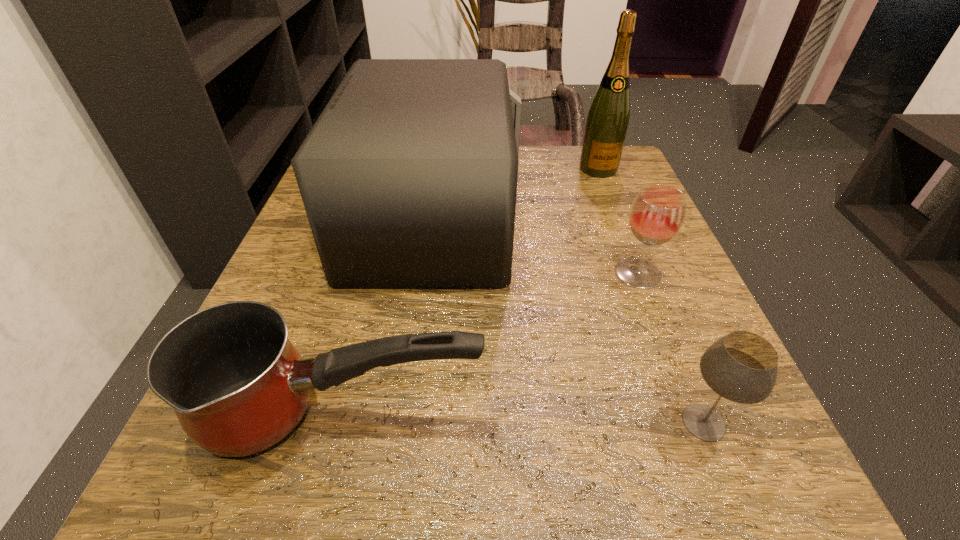
You are a GUI agent. You are given a task and a screenshot of the screen. Output one action in this format:
    pyautogui.click(x=<x>, y=<y>)
    Task: Click on the empty space that is in between the saucepan and the farther wineglass
    The width and height of the screenshot is (960, 540).
    Given the screenshot: What is the action you would take?
    pyautogui.click(x=491, y=345)

I want to click on empty location between the tallest object and the saucepan, so click(x=470, y=292).

The image size is (960, 540). What are the coordinates of `free space between the fourth shortest object and the farther wineglass` in the screenshot? It's located at (536, 246).

You are a GUI agent. You are given a task and a screenshot of the screen. Output one action in this format:
    pyautogui.click(x=<x>, y=<y>)
    Task: Click on the free space between the saucepan and the nearer wineglass
    The width and height of the screenshot is (960, 540).
    Given the screenshot: What is the action you would take?
    pyautogui.click(x=523, y=419)

The width and height of the screenshot is (960, 540). What are the coordinates of `object that can be found as the closest to the farther wineglass` in the screenshot? It's located at (408, 177).

Image resolution: width=960 pixels, height=540 pixels. In order to click on object identified as the second closest to the farther wineglass in this screenshot , I will do `click(742, 367)`.

Locate an element on the screen. This screenshot has width=960, height=540. vacant region that satisfies the following two spatial constraints: 1. on the front-facing side of the microwave oven; 2. on the right side of the nearer wineglass is located at coordinates (407, 422).

Locate an element on the screen. Image resolution: width=960 pixels, height=540 pixels. vacant space that satisfies the following two spatial constraints: 1. on the front-facing side of the microwave oven; 2. on the left side of the farther wineglass is located at coordinates (426, 273).

Where is `free space that satisfies the following two spatial constraints: 1. on the front side of the farther wineglass; 2. on the handle side of the saucepan`? This screenshot has width=960, height=540. free space that satisfies the following two spatial constraints: 1. on the front side of the farther wineglass; 2. on the handle side of the saucepan is located at coordinates (693, 415).

The height and width of the screenshot is (540, 960). In order to click on free space that satisfies the following two spatial constraints: 1. on the front-facing side of the farther wineglass; 2. on the left side of the fourth shortest object in this screenshot , I will do `click(426, 273)`.